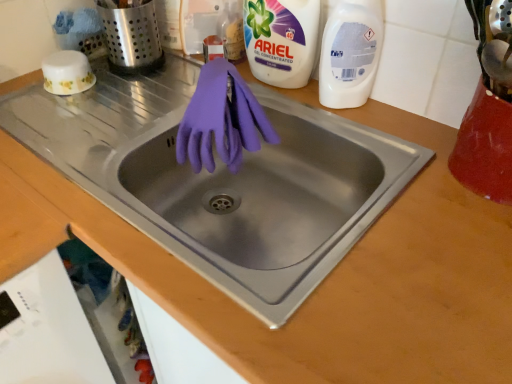
The height and width of the screenshot is (384, 512). What are the coordinates of `vacant space to the right of white plastic bottle at upper right, which is the second cleaning product from left to right` in the screenshot? It's located at (396, 119).